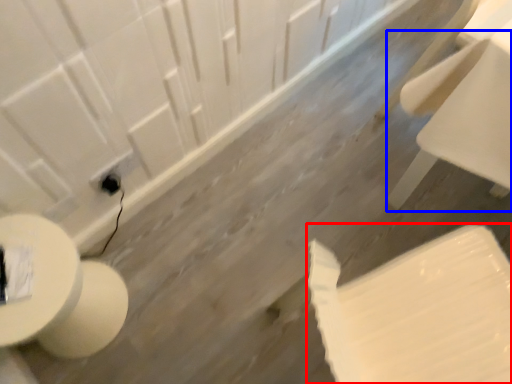
Question: Which object is closer to the camera taking this photo, toilet paper (highlighted by a red box) or chair (highlighted by a blue box)?

Choices:
 (A) toilet paper
 (B) chair

Answer: (A)